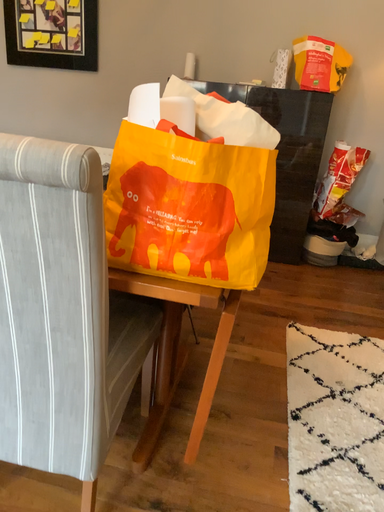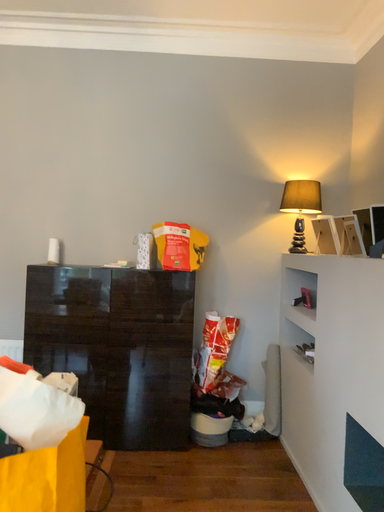
Question: Which way did the camera rotate in the video?

Choices:
 (A) rotated upward
 (B) rotated downward

Answer: (A)